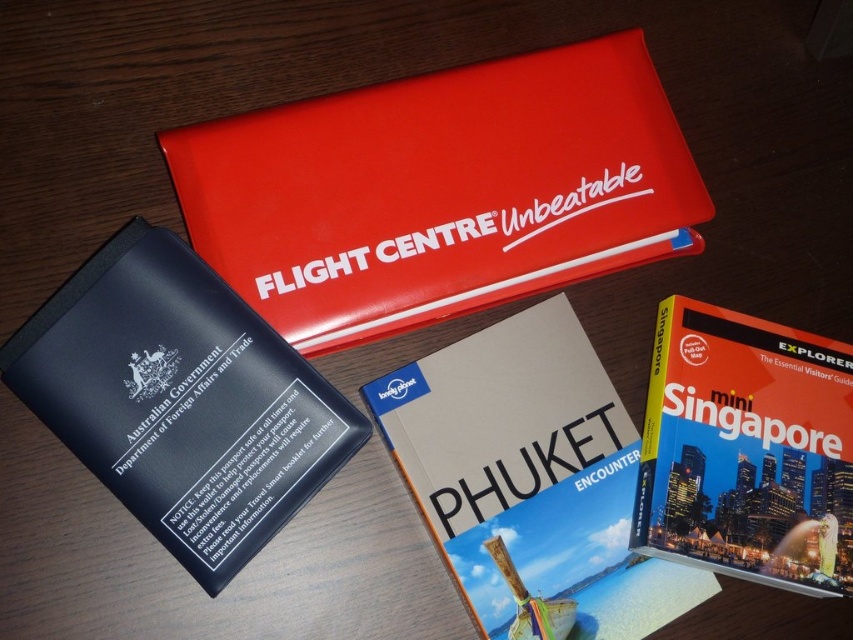
Can you confirm if glossy plastic binder at upper center is positioned to the right of matte black passport at upper left?

Yes, glossy plastic binder at upper center is to the right of matte black passport at upper left.

At what (x,y) coordinates should I click in order to perform the action: click on glossy plastic binder at upper center. Please return your answer as a coordinate pair (x, y). The height and width of the screenshot is (640, 853). Looking at the image, I should click on (440, 189).

Does matte black passport at upper left have a lesser height compared to hardcover book at upper right?

Incorrect, matte black passport at upper left's height does not fall short of hardcover book at upper right's.

Which is in front, point (38, 310) or point (758, 380)?

Point (38, 310) is more forward.

Image resolution: width=853 pixels, height=640 pixels. In order to click on matte black passport at upper left in this screenshot , I will do `click(180, 401)`.

Can you confirm if matte black passport at upper left is shorter than hardcover book at center?

No.

Can you confirm if matte black passport at upper left is thinner than hardcover book at center?

Yes.

Who is more distant from viewer, (x=297, y=500) or (x=582, y=394)?

The point (x=582, y=394) is more distant.

Identify the location of matte black passport at upper left. The height and width of the screenshot is (640, 853). (180, 401).